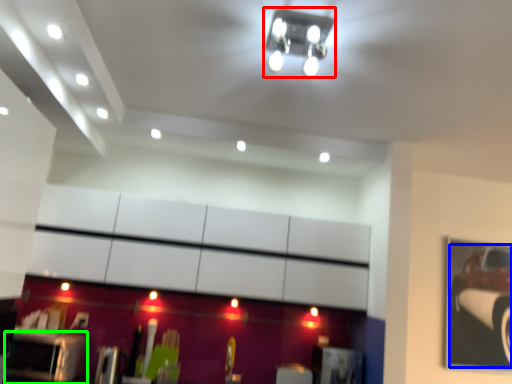
Question: Estimate the real-world distances between objects in this image. Which object is farther from light fixture (highlighted by a red box), car (highlighted by a blue box) or furniture (highlighted by a green box)?

Choices:
 (A) car
 (B) furniture

Answer: (A)